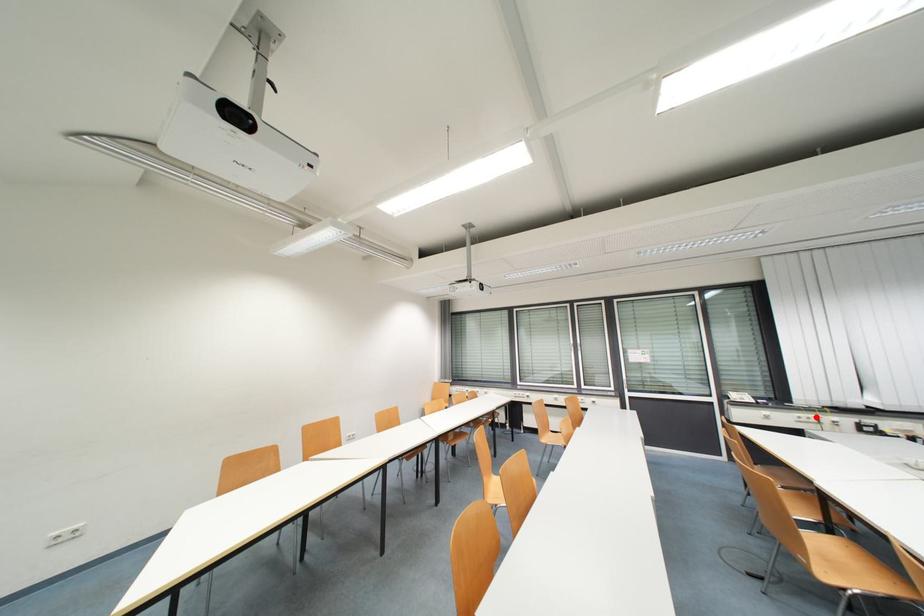
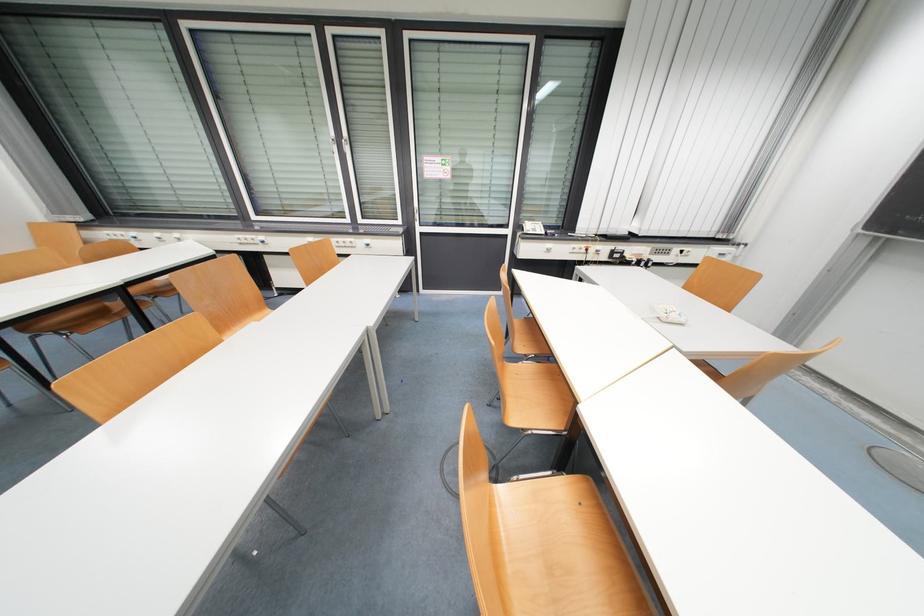
Where in the second image is the point corresponding to the highlighted location from the first image?

(589, 246)